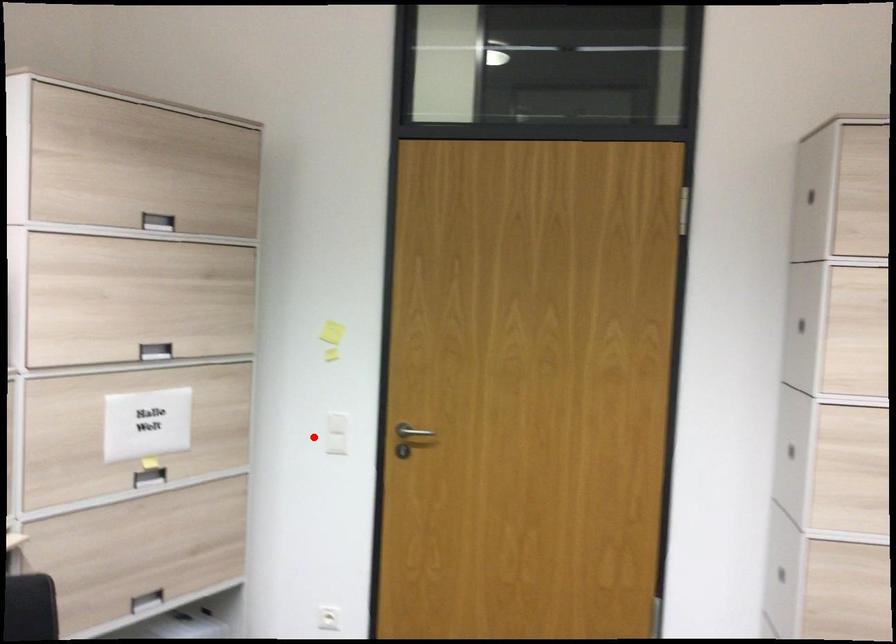
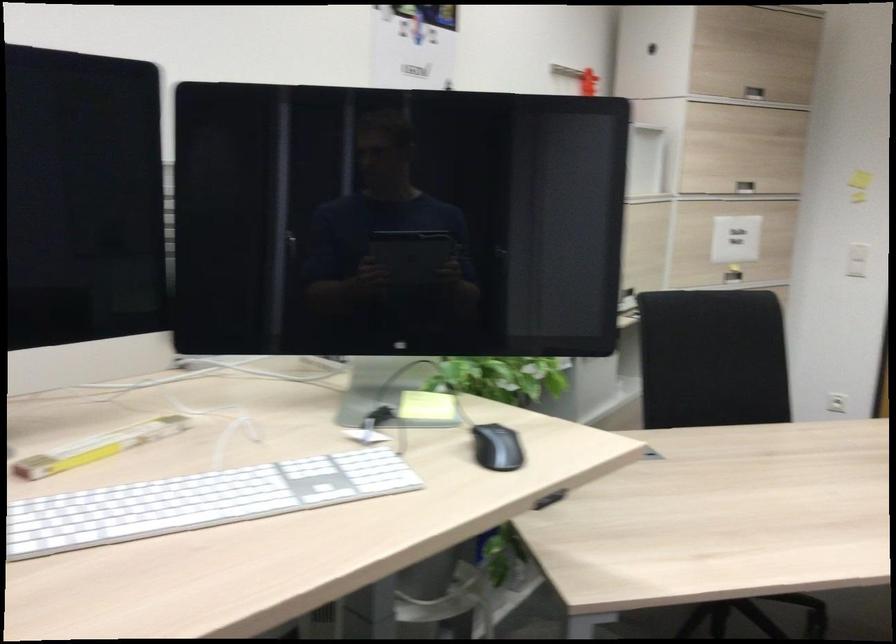
Where in the second image is the point corresponding to the highlighted location from the first image?

(857, 260)